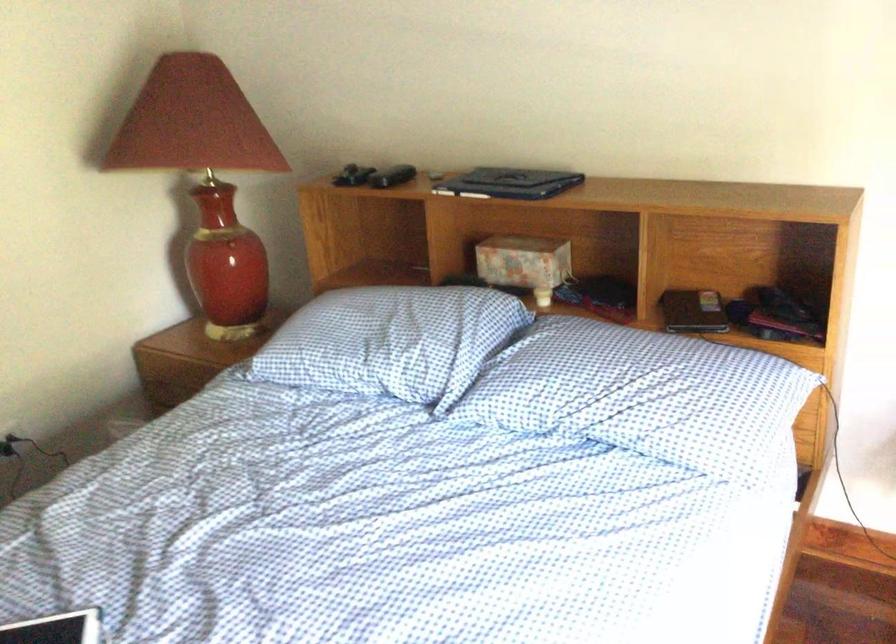
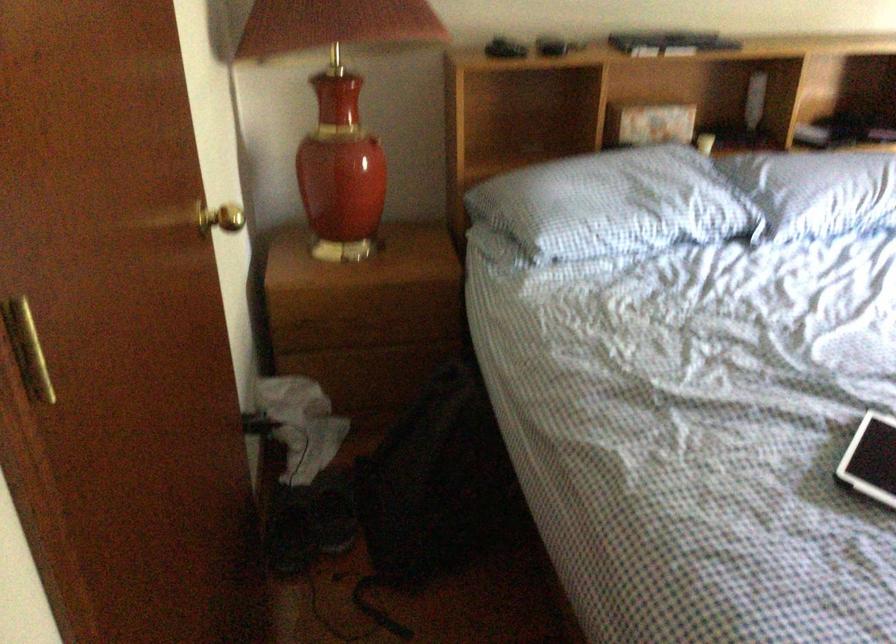
Find the pixel in the second image that matches point 340,337 in the first image.

(613, 204)